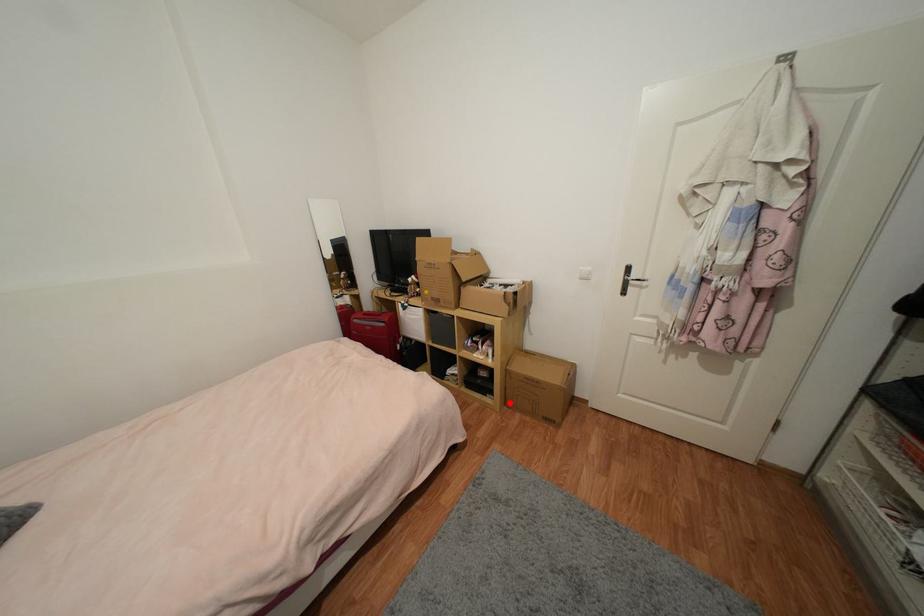
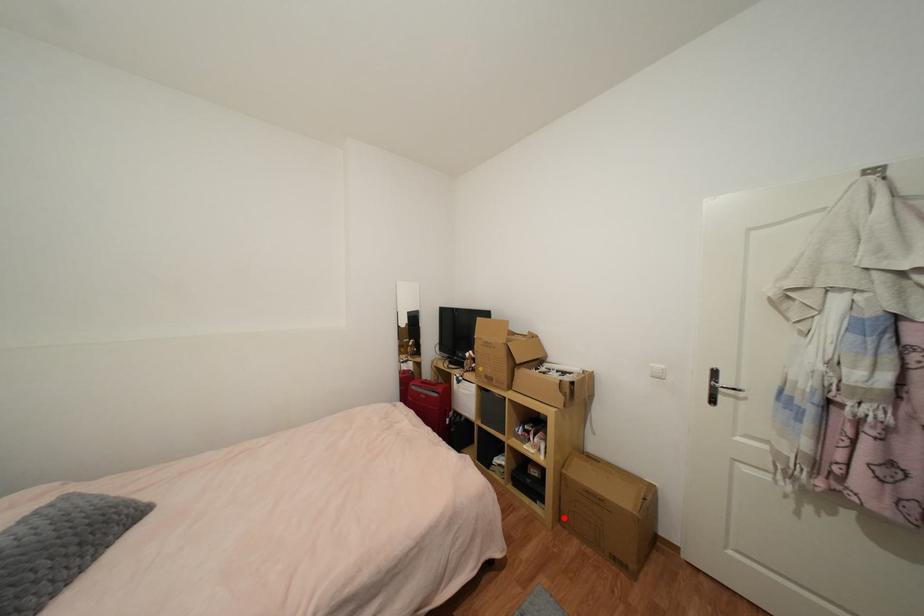
I am providing you with two images of the same scene from different viewpoints. A red point is marked on the first image and another point is marked on the second image. Do the highlighted points in image1 and image2 indicate the same real-world spot?

Yes